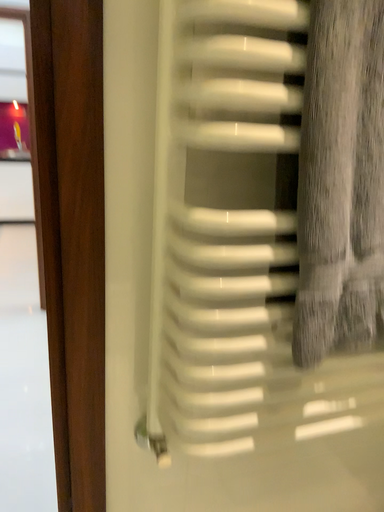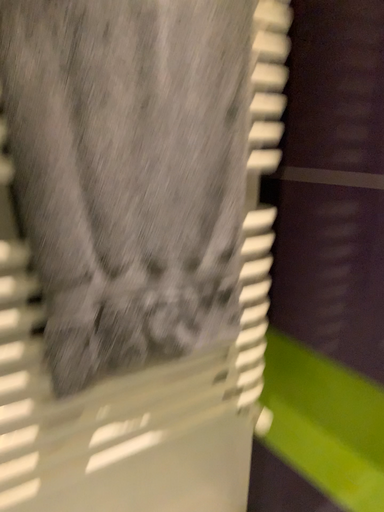
Question: How did the camera likely rotate when shooting the video?

Choices:
 (A) rotated right
 (B) rotated left

Answer: (A)